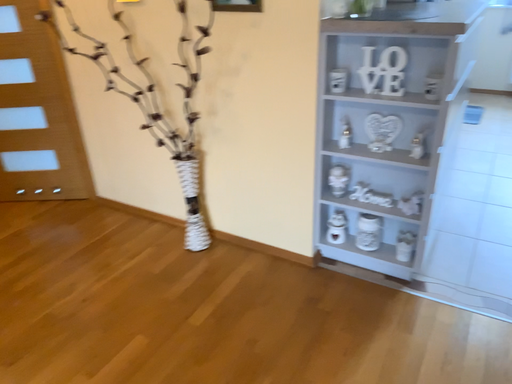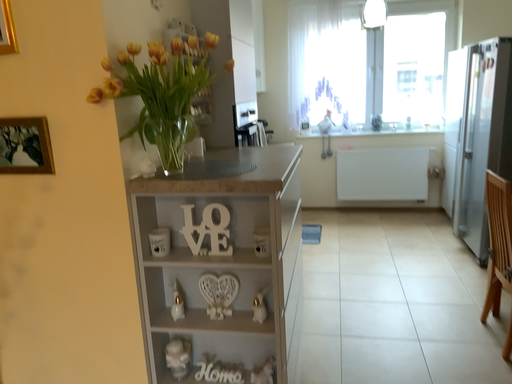
Question: How did the camera likely rotate when shooting the video?

Choices:
 (A) rotated left
 (B) rotated right

Answer: (B)